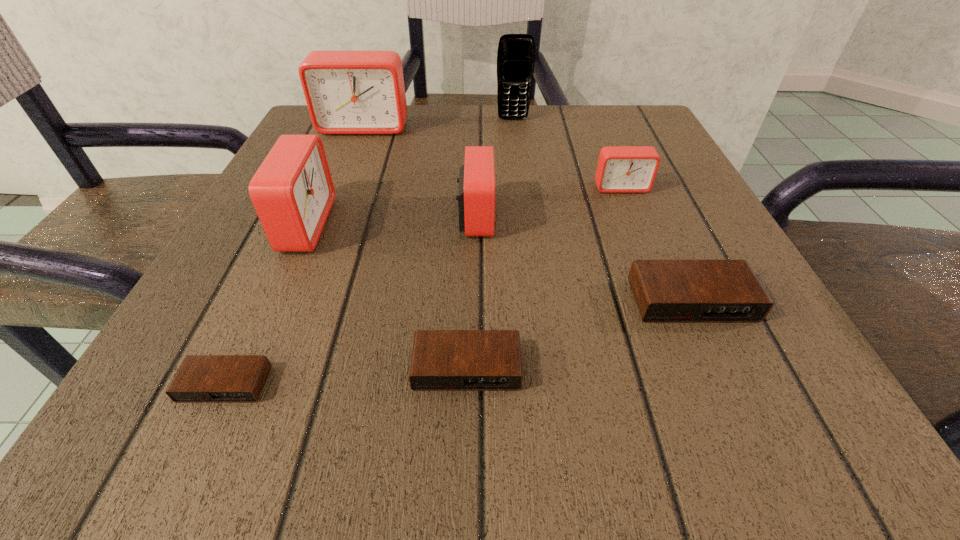
I want to click on free space between the fifth shortest object and the seventh tallest object, so click(x=471, y=292).

Locate which object ranks seventh in proximity to the rightmost red alarm clock. Please provide its 2D coordinates. Your answer should be formatted as a tuple, i.e. [(x, y)], where the tuple contains the x and y coordinates of a point satisfying the conditions above.

[(200, 378)]

The height and width of the screenshot is (540, 960). What are the coordinates of `object identified as the second closest to the sixth shortest alarm clock` in the screenshot? It's located at (476, 194).

At what (x,y) coordinates should I click in order to perform the action: click on alarm clock object that ranks as the closest to the third biggest red alarm clock. Please return your answer as a coordinate pair (x, y). This screenshot has height=540, width=960. Looking at the image, I should click on (621, 169).

Where is `alarm clock that can be found as the fourth closest to the smallest black alarm clock`? The width and height of the screenshot is (960, 540). alarm clock that can be found as the fourth closest to the smallest black alarm clock is located at coordinates (666, 291).

What are the coordinates of `red alarm clock that is the second closest to the leftmost black alarm clock` in the screenshot? It's located at (476, 194).

Locate an element on the screen. This screenshot has width=960, height=540. red alarm clock object that ranks as the fourth closest to the cellular telephone is located at coordinates (292, 192).

Select which black alarm clock appears as the closest to the rightmost red alarm clock. Please provide its 2D coordinates. Your answer should be formatted as a tuple, i.e. [(x, y)], where the tuple contains the x and y coordinates of a point satisfying the conditions above.

[(666, 291)]

Identify which black alarm clock is the second closest to the smallest black alarm clock. Please provide its 2D coordinates. Your answer should be formatted as a tuple, i.e. [(x, y)], where the tuple contains the x and y coordinates of a point satisfying the conditions above.

[(666, 291)]

You are a GUI agent. You are given a task and a screenshot of the screen. Output one action in this format:
    pyautogui.click(x=<x>, y=<y>)
    Task: Click on the vacant space that satisfies the following two spatial constraints: 1. on the front-facing side of the fourth tallest object; 2. on the front face of the leftmost black alarm clock
    
    Given the screenshot: What is the action you would take?
    pyautogui.click(x=474, y=384)